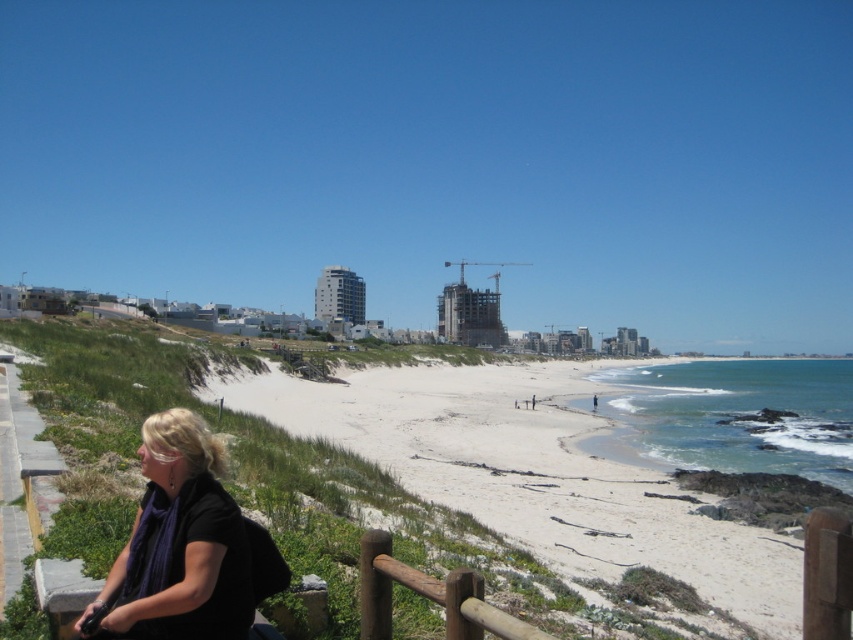
You are a photographer trying to capture the perfect shot of the black matte scarf at lower left. The camera you are using has a focal length of 50mm. If you want to ensure the scarf is in the center of your frame, how should you position your camera relative to the scarf?

The black matte scarf at lower left is located at coordinates (178,545). To center it in your 50mm focal length camera frame, position the camera so the scarf aligns with the center point of your viewfinder at those coordinates.

You are a photographer standing on the beach and want to capture both the black matte scarf at lower left and the brown wooden rail at lower center in the same frame. Based on their positions, which object should you adjust your camera angle to include first?

The black matte scarf at lower left is to the left of the brown wooden rail at lower center, so you should adjust your camera angle to include the black matte scarf at lower left first before the brown wooden rail at lower center.

Consider the image. You are a photographer trying to capture the perfect shot of the brown wooden rail at lower center and the black matte scarf at lower left. Which object would you need to zoom in more on to fill the frame, considering their sizes?

The black matte scarf at lower left is thinner than the brown wooden rail at lower center, so you would need to zoom in more on the black matte scarf at lower left to fill the frame due to its smaller size.